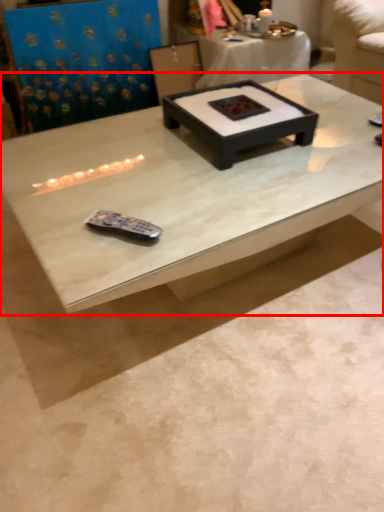
Question: From the image's perspective, what is the correct spatial positioning of coffee table (annotated by the red box) in reference to coffee table?

Choices:
 (A) below
 (B) above

Answer: (A)